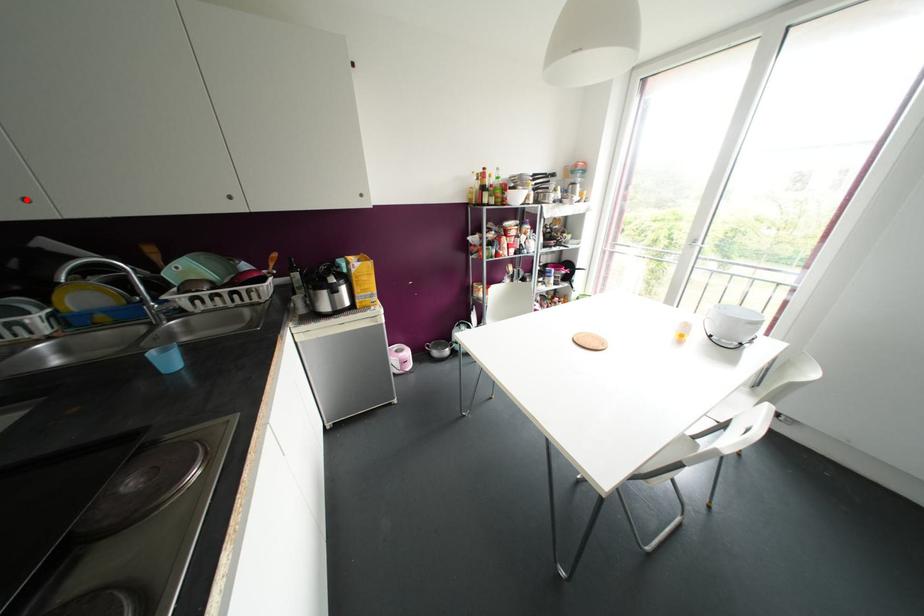
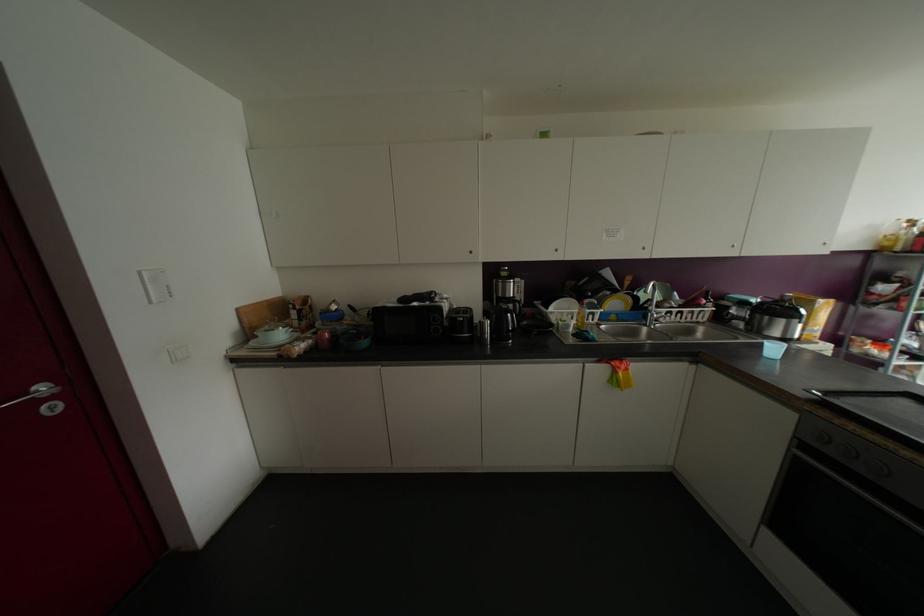
Question: I am providing you with two images of the same scene from different viewpoints. A red point is marked on the first image. Is the red point's position out of view in image 2?

Choices:
 (A) Yes
 (B) No

Answer: (B)